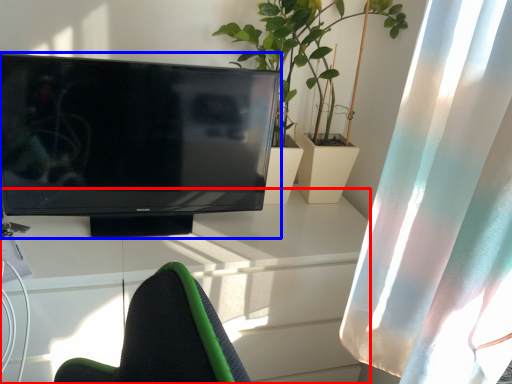
Question: Which object appears closest to the camera in this image, desk (highlighted by a red box) or television (highlighted by a blue box)?

Choices:
 (A) desk
 (B) television

Answer: (B)